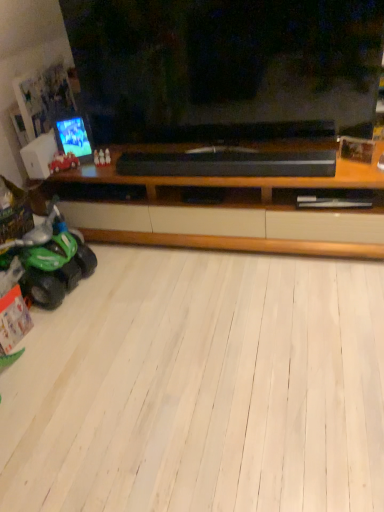
Question: Can you confirm if shiny plastic phone at left is taller than white plastic speaker at left?

Choices:
 (A) yes
 (B) no

Answer: (A)

Question: From a real-world perspective, does shiny plastic phone at left stand above white plastic speaker at left?

Choices:
 (A) yes
 (B) no

Answer: (A)

Question: Can you confirm if shiny plastic phone at left is positioned to the right of white plastic speaker at left?

Choices:
 (A) no
 (B) yes

Answer: (B)

Question: Is shiny plastic phone at left oriented towards white plastic speaker at left?

Choices:
 (A) no
 (B) yes

Answer: (A)

Question: Is the position of shiny plastic phone at left less distant than that of white plastic speaker at left?

Choices:
 (A) yes
 (B) no

Answer: (B)

Question: From the image's perspective, is shiny red toy car at left, the first land vehicle viewed from the top, above or below green plastic toy car at lower left, which appears as the 2th land vehicle when viewed from the top?

Choices:
 (A) above
 (B) below

Answer: (A)

Question: Relative to green plastic toy car at lower left, which is the first land vehicle from bottom to top, is shiny red toy car at left, which appears as the 2th land vehicle when ordered from the bottom, in front or behind?

Choices:
 (A) front
 (B) behind

Answer: (B)

Question: In terms of height, does shiny red toy car at left, which appears as the 2th land vehicle when ordered from the bottom, look taller or shorter compared to green plastic toy car at lower left, which appears as the 2th land vehicle when viewed from the top?

Choices:
 (A) tall
 (B) short

Answer: (B)

Question: From a real-world perspective, is shiny red toy car at left, which appears as the 2th land vehicle when ordered from the bottom, above or below green plastic toy car at lower left, which appears as the 2th land vehicle when viewed from the top?

Choices:
 (A) below
 (B) above

Answer: (B)

Question: From a real-world perspective, is shiny plastic phone at left positioned above or below white plastic speaker at left?

Choices:
 (A) below
 (B) above

Answer: (B)

Question: In the image, is shiny plastic phone at left positioned in front of or behind white plastic speaker at left?

Choices:
 (A) front
 (B) behind

Answer: (B)

Question: From the image's perspective, is shiny plastic phone at left positioned above or below white plastic speaker at left?

Choices:
 (A) above
 (B) below

Answer: (A)

Question: Considering the positions of point (71, 152) and point (54, 140), is point (71, 152) closer or farther from the camera than point (54, 140)?

Choices:
 (A) farther
 (B) closer

Answer: (B)

Question: Considering the positions of point (41, 297) and point (76, 128), is point (41, 297) closer or farther from the camera than point (76, 128)?

Choices:
 (A) closer
 (B) farther

Answer: (A)

Question: From the image's perspective, is green plastic toy car at lower left, which appears as the 2th land vehicle when viewed from the top, positioned above or below shiny plastic phone at left?

Choices:
 (A) above
 (B) below

Answer: (B)